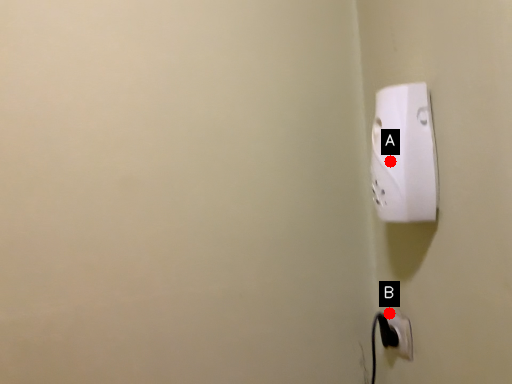
Question: Two points are circled on the image, labeled by A and B beside each circle. Which point is farther from the camera taking this photo?

Choices:
 (A) A is further
 (B) B is further

Answer: (B)